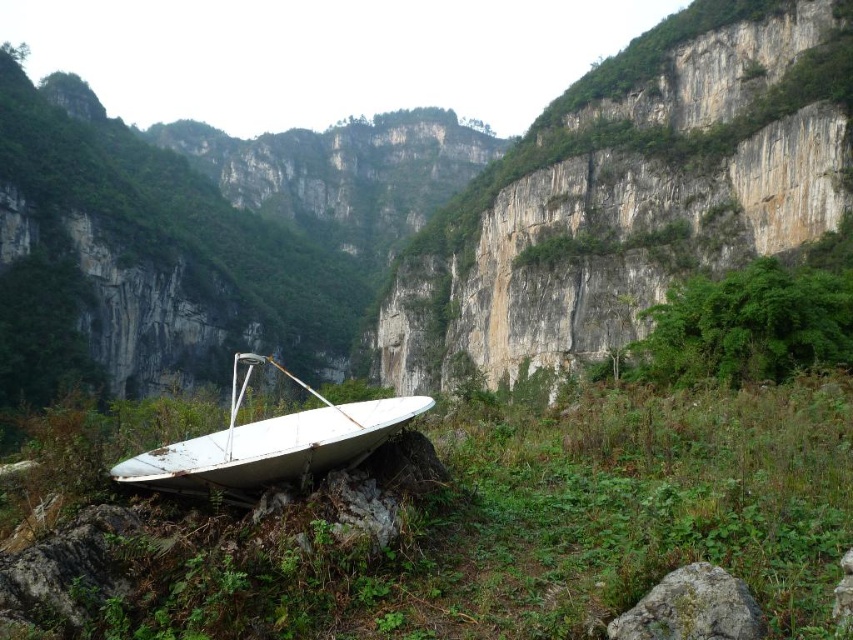
Can you confirm if rough stone cliff at center is wider than gray rough rock at lower right?

Yes, rough stone cliff at center is wider than gray rough rock at lower right.

Can you confirm if rough stone cliff at center is bigger than gray rough rock at lower right?

Indeed, rough stone cliff at center has a larger size compared to gray rough rock at lower right.

Between point (788, 150) and point (608, 625), which one is positioned in front?

Point (608, 625)

I want to click on rough stone cliff at center, so click(631, 195).

Does white matte boat at center have a lesser height compared to gray rough rock at lower right?

No.

Which is in front, point (251, 353) or point (631, 620)?

Point (631, 620) is more forward.

Which is in front, point (224, 481) or point (660, 628)?

Point (660, 628) is in front.

This screenshot has width=853, height=640. Find the location of `white matte boat at center`. white matte boat at center is located at coordinates (270, 444).

You are a GUI agent. You are given a task and a screenshot of the screen. Output one action in this format:
    pyautogui.click(x=<x>, y=<y>)
    Task: Click on the rough stone cliff at center
    The height and width of the screenshot is (640, 853).
    Given the screenshot: What is the action you would take?
    pyautogui.click(x=631, y=195)

Is rough stone cliff at center to the right of white matte boat at center from the viewer's perspective?

Correct, you'll find rough stone cliff at center to the right of white matte boat at center.

Does point (500, 252) come closer to viewer compared to point (173, 467)?

That is False.

Image resolution: width=853 pixels, height=640 pixels. In order to click on rough stone cliff at center in this screenshot , I will do `click(631, 195)`.